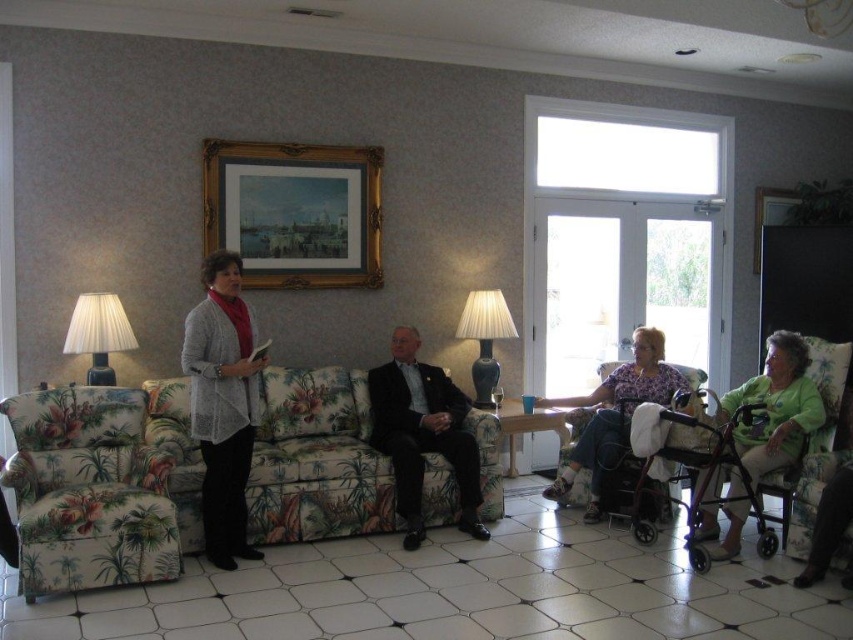
Is black suit at center above floral fabric walker at lower right?

No.

Is black suit at center closer to camera compared to floral fabric walker at lower right?

Yes, it is in front of floral fabric walker at lower right.

Where is `black suit at center`? The image size is (853, 640). black suit at center is located at coordinates (422, 433).

Is point (782, 506) behind point (850, 512)?

Yes, point (782, 506) is farther from viewer.

From the picture: Who is positioned more to the right, green fabric armchair at lower right or dark gray pants at lower right?

Positioned to the right is green fabric armchair at lower right.

Is point (776, 518) more distant than point (816, 557)?

Yes.

In order to click on green fabric armchair at lower right in this screenshot , I will do `click(811, 445)`.

Which is below, matte ceramic lamp at center or wooden picture frame at upper right?

matte ceramic lamp at center

Is matte ceramic lamp at center to the right of wooden picture frame at upper right from the viewer's perspective?

Incorrect, matte ceramic lamp at center is not on the right side of wooden picture frame at upper right.

Is point (486, 403) positioned before point (770, 208)?

Yes, point (486, 403) is closer to viewer.

Identify the location of matte ceramic lamp at center. This screenshot has height=640, width=853. (485, 339).